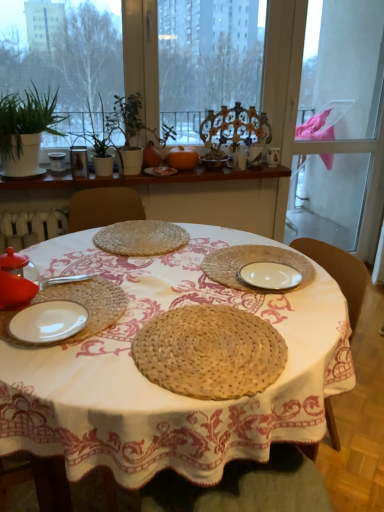
Image resolution: width=384 pixels, height=512 pixels. In order to click on free space that is in between white glossy plate at lower left, which is the fourth plate in back-to-front order, and woven straw placemat at center, which is the 4th plate in bottom-to-top order in this screenshot , I will do (110, 273).